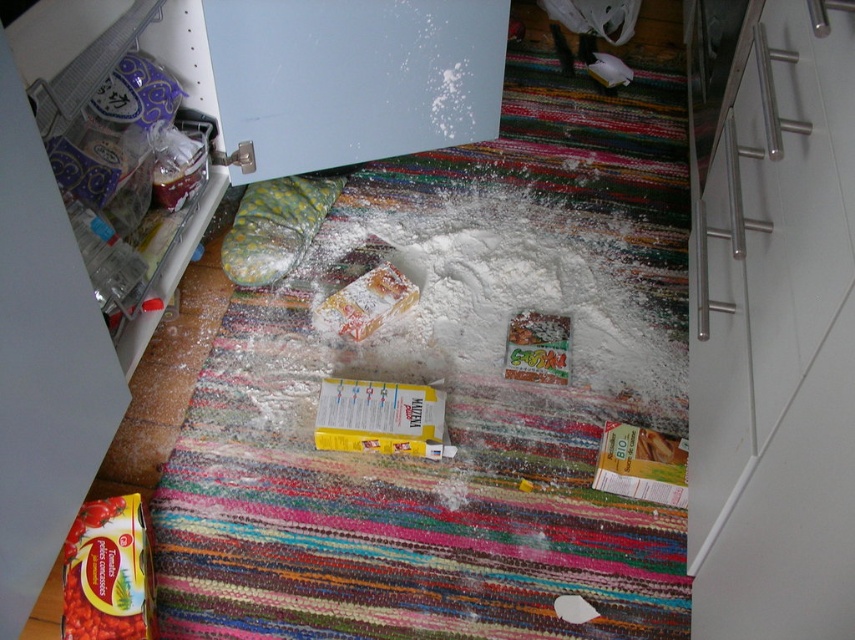
You are trying to reach for the matte yellow tomato paste at lower left while standing in front of the white matte refrigerator at upper center. Considering their sizes, which object would you need to move first to get a better access?

The white matte refrigerator at upper center has a larger size compared to matte yellow tomato paste at lower left. Since the refrigerator is larger, you would need to move it first to access the smaller matte yellow tomato paste at lower left.

You are a chef who needs to reach the matte yellow tomato paste at lower left from the white matte refrigerator at upper center. Can you stretch your arm to grab it without moving your body?

→ The white matte refrigerator at upper center is 27.07 inches away from the matte yellow tomato paste at lower left. Since the average human arm length is about 25 inches, you might need to move slightly closer to reach it.

You are trying to reach the matte yellow tomato paste at lower left from your current position near the white matte refrigerator at upper center. Which direction should you move to get closer to the tomato paste?

Since the white matte refrigerator at upper center is closer to you than the matte yellow tomato paste at lower left, you should move downward to get closer to the matte yellow tomato paste at lower left.